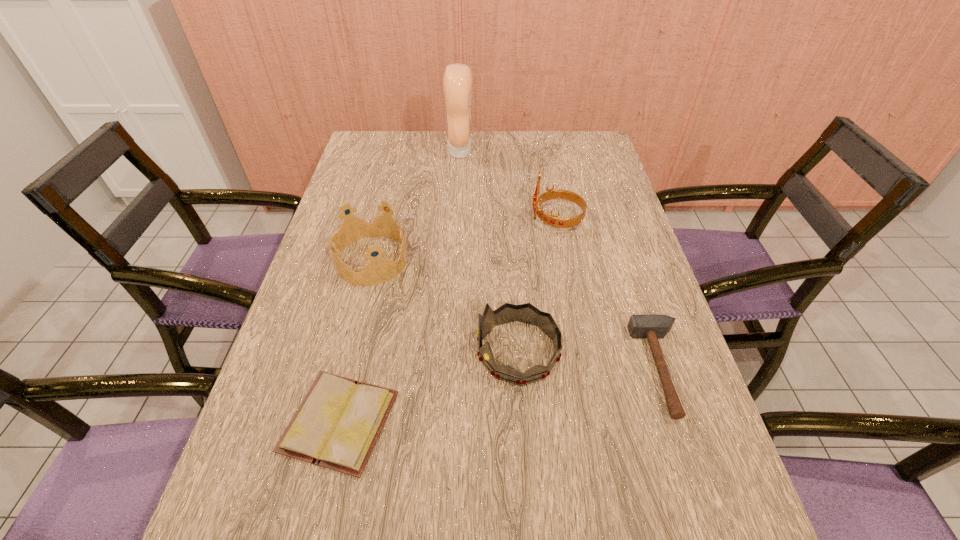
Find the location of `vacant space located 0.220m on the label of the fourth object from right to left`. vacant space located 0.220m on the label of the fourth object from right to left is located at coordinates (536, 152).

Find the location of a particular element. free space located on the front-facing side of the second farthest object is located at coordinates (486, 220).

Find the location of a particular element. Image resolution: width=960 pixels, height=540 pixels. free space located on the front-facing side of the second farthest object is located at coordinates (510, 220).

At what (x,y) coordinates should I click in order to perform the action: click on free space located on the front-facing side of the second farthest object. Please return your answer as a coordinate pair (x, y). This screenshot has width=960, height=540. Looking at the image, I should click on (x=410, y=220).

Image resolution: width=960 pixels, height=540 pixels. In order to click on free space located 0.060m at the front of the nearest tiara with jewels in this screenshot , I will do `click(448, 352)`.

You are a GUI agent. You are given a task and a screenshot of the screen. Output one action in this format:
    pyautogui.click(x=<x>, y=<y>)
    Task: Click on the vacant area situated 0.380m at the front of the nearest tiara with jewels
    The height and width of the screenshot is (540, 960).
    Given the screenshot: What is the action you would take?
    pyautogui.click(x=303, y=352)

This screenshot has height=540, width=960. Find the location of `blank space located at the front of the nearest tiara with jewels`. blank space located at the front of the nearest tiara with jewels is located at coordinates (353, 352).

Locate an element on the screen. free spot located 0.280m on the front-facing side of the third farthest object is located at coordinates (x=514, y=260).

Where is `blank space located on the striking surface of the rightmost object`? blank space located on the striking surface of the rightmost object is located at coordinates (479, 369).

Locate an element on the screen. The image size is (960, 540). blank area located on the striking surface of the rightmost object is located at coordinates (493, 369).